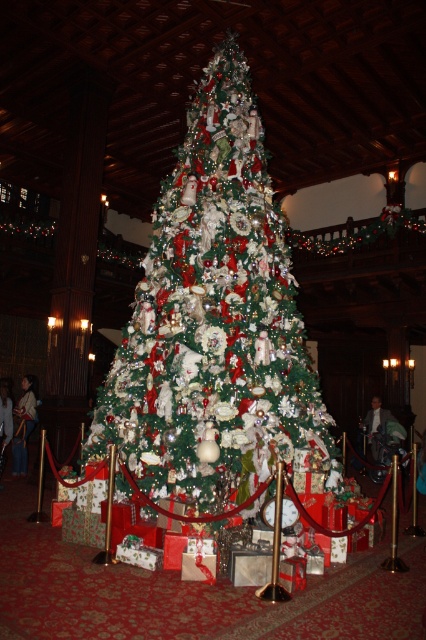
Can you confirm if light brown leather jacket at lower left is thinner than white fabric dress at center?

Yes.

Who is positioned more to the left, light brown leather jacket at lower left or white fabric dress at center?

light brown leather jacket at lower left is more to the left.

Where is `light brown leather jacket at lower left`? The image size is (426, 640). light brown leather jacket at lower left is located at coordinates [23, 422].

Find the location of a particular element. This screenshot has height=640, width=426. light brown leather jacket at lower left is located at coordinates (23, 422).

Which of these two, green matte christmas tree at center or green velvet suit at center, stands taller?

green matte christmas tree at center is taller.

Is point (209, 268) farther from viewer compared to point (368, 429)?

That is False.

Who is more forward, (252,324) or (368,413)?

Positioned in front is point (252,324).

Locate an element on the screen. This screenshot has width=426, height=640. green matte christmas tree at center is located at coordinates (215, 323).

Is green matte christmas tree at center positioned at the back of white fabric dress at center?

No, green matte christmas tree at center is in front of white fabric dress at center.

Who is lower down, green matte christmas tree at center or white fabric dress at center?

white fabric dress at center is below.

Is point (184, 461) more distant than point (0, 388)?

No, it is in front of (0, 388).

At what (x,y) coordinates should I click in order to perform the action: click on green matte christmas tree at center. Please return your answer as a coordinate pair (x, y). Image resolution: width=426 pixels, height=640 pixels. Looking at the image, I should click on (215, 323).